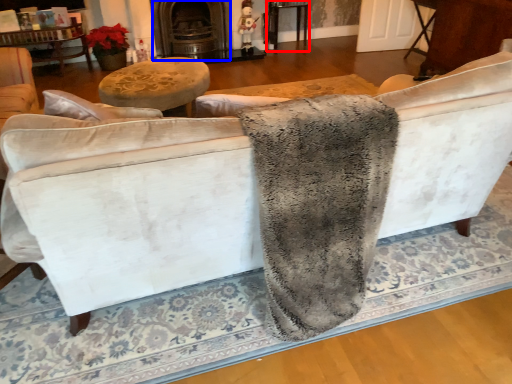
Question: Which object is closer to the camera taking this photo, table (highlighted by a red box) or fireplace (highlighted by a blue box)?

Choices:
 (A) table
 (B) fireplace

Answer: (B)